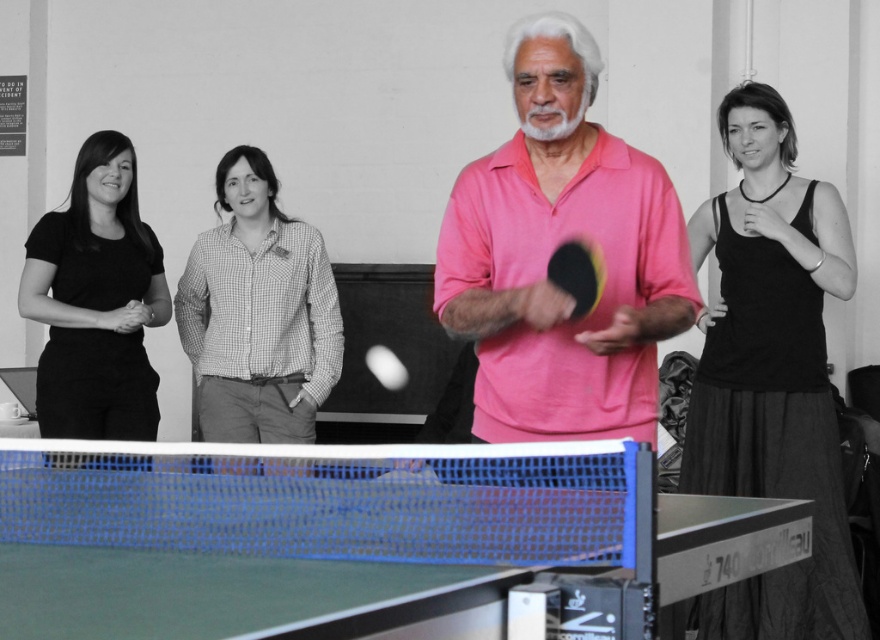
Who is positioned more to the left, checkered fabric shirt at center or black matte shirt at left?

black matte shirt at left is more to the left.

Can you confirm if checkered fabric shirt at center is thinner than black matte shirt at left?

In fact, checkered fabric shirt at center might be wider than black matte shirt at left.

Find the location of `checkered fabric shirt at center`. checkered fabric shirt at center is located at coordinates (258, 314).

Can you confirm if pink matte ping pong paddle at center is thinner than black matte shirt at left?

Incorrect, pink matte ping pong paddle at center's width is not less than black matte shirt at left's.

Measure the distance from pink matte ping pong paddle at center to black matte shirt at left.

pink matte ping pong paddle at center is 6.86 feet away from black matte shirt at left.

Is point (658, 280) more distant than point (41, 403)?

No, (658, 280) is in front of (41, 403).

Locate an element on the screen. pink matte ping pong paddle at center is located at coordinates (554, 248).

What do you see at coordinates (554, 248) in the screenshot? I see `pink matte ping pong paddle at center` at bounding box center [554, 248].

Between pink matte ping pong paddle at center and checkered fabric shirt at center, which one has more height?

checkered fabric shirt at center is taller.

Find the location of a particular element. This screenshot has height=640, width=880. pink matte ping pong paddle at center is located at coordinates (554, 248).